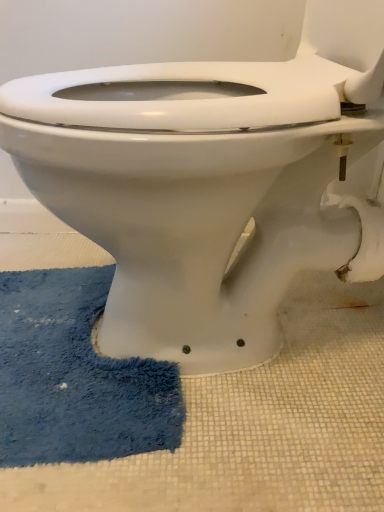
Question: From a real-world perspective, is white glossy toilet at center positioned above or below blue plush bath mat at lower left?

Choices:
 (A) below
 (B) above

Answer: (B)

Question: Looking at their shapes, would you say white glossy toilet at center is wider or thinner than blue plush bath mat at lower left?

Choices:
 (A) thin
 (B) wide

Answer: (B)

Question: Based on their sizes in the image, would you say white glossy toilet at center is bigger or smaller than blue plush bath mat at lower left?

Choices:
 (A) big
 (B) small

Answer: (A)

Question: From the image's perspective, is blue plush bath mat at lower left located above or below white glossy toilet at center?

Choices:
 (A) above
 (B) below

Answer: (B)

Question: In the image, is blue plush bath mat at lower left positioned in front of or behind white glossy toilet at center?

Choices:
 (A) behind
 (B) front

Answer: (A)

Question: Is blue plush bath mat at lower left situated inside white glossy toilet at center or outside?

Choices:
 (A) inside
 (B) outside

Answer: (B)

Question: Considering the positions of blue plush bath mat at lower left and white glossy toilet at center in the image, is blue plush bath mat at lower left wider or thinner than white glossy toilet at center?

Choices:
 (A) thin
 (B) wide

Answer: (A)